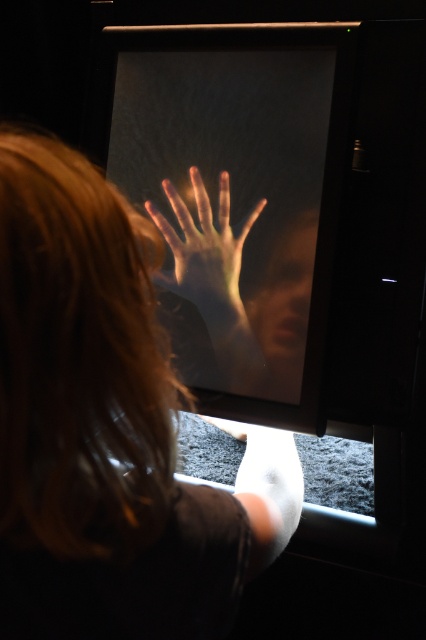
Consider the image. You are trying to clean the transparent glass screen at center but need to avoid touching the smooth skin hand at center. Based on their positions, which object should you approach first?

You should approach the smooth skin hand at center first because it is closer to the viewer than the transparent glass screen at center, so reaching it won

You are an artist analyzing the image. You notice the smooth skin hand at center and the smooth skin face at center in the reflection. Which object appears taller in the reflection?

The smooth skin hand at center appears much taller than the smooth skin face at center in the reflection.